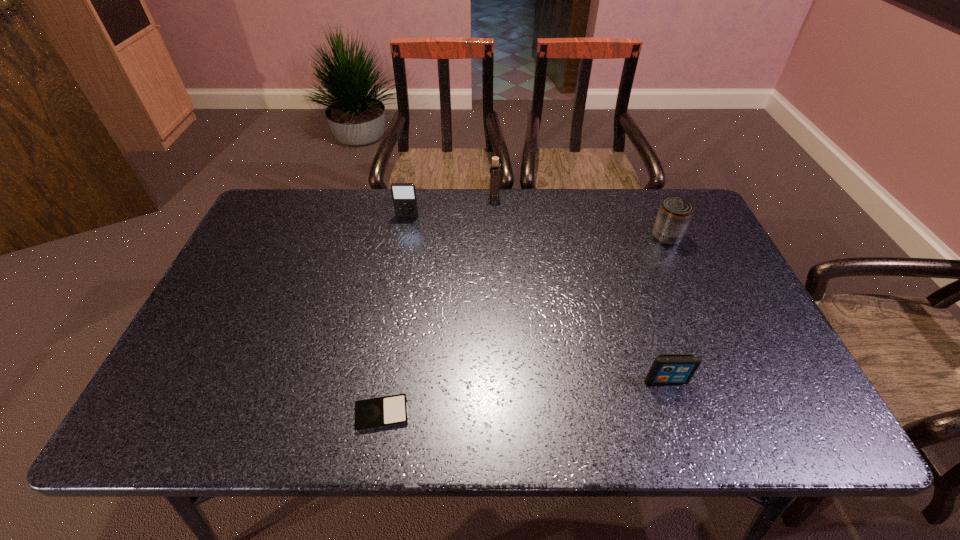
Where is `vacant area between the rightmost object and the tallest object`? vacant area between the rightmost object and the tallest object is located at coordinates (581, 217).

At what (x,y) coordinates should I click in order to perform the action: click on free spot between the third object from left to right and the rightmost object. Please return your answer as a coordinate pair (x, y). This screenshot has height=540, width=960. Looking at the image, I should click on (581, 217).

Locate an element on the screen. free area in between the rightmost object and the shortest iPod is located at coordinates (524, 325).

Identify the location of unoccupied area between the tallest iPod and the rightmost iPod. (537, 299).

This screenshot has width=960, height=540. What are the coordinates of `vacant space that's between the farthest object and the second shortest iPod` in the screenshot? It's located at (580, 289).

At what (x,y) coordinates should I click in order to perform the action: click on unoccupied area between the third farthest object and the fourth farthest object. Please return your answer as a coordinate pair (x, y). Image resolution: width=960 pixels, height=540 pixels. Looking at the image, I should click on (666, 309).

The image size is (960, 540). Find the location of `empty space that is in between the rightmost object and the rightmost iPod`. empty space that is in between the rightmost object and the rightmost iPod is located at coordinates (666, 309).

Point out which object is positioned as the second nearest to the fourth object from left to right. Please provide its 2D coordinates. Your answer should be formatted as a tuple, i.e. [(x, y)], where the tuple contains the x and y coordinates of a point satisfying the conditions above.

[(387, 411)]

Identify which object is the closest to the fourth object from left to right. Please provide its 2D coordinates. Your answer should be formatted as a tuple, i.e. [(x, y)], where the tuple contains the x and y coordinates of a point satisfying the conditions above.

[(674, 216)]

This screenshot has width=960, height=540. Find the location of `the closest iPod relative to the second shortest object`. the closest iPod relative to the second shortest object is located at coordinates (387, 411).